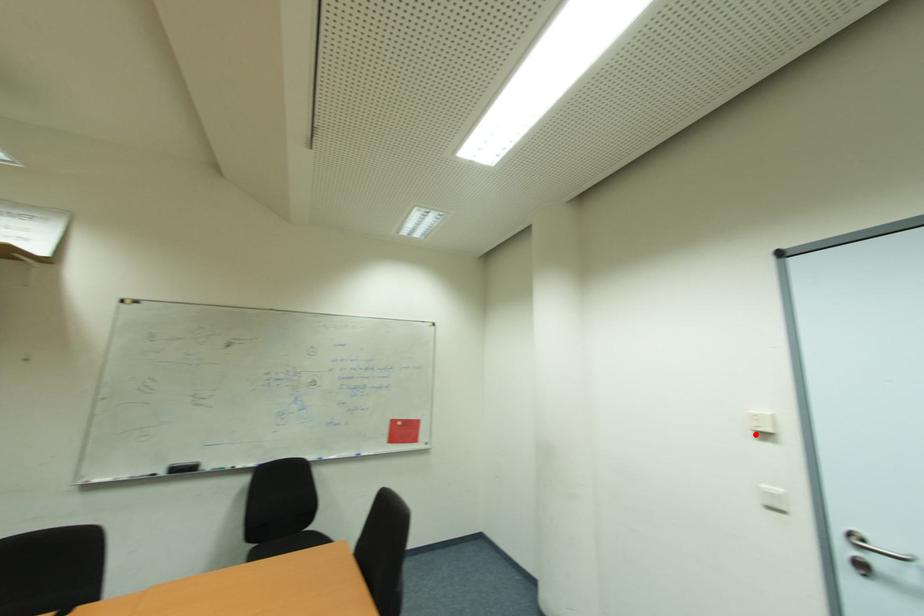
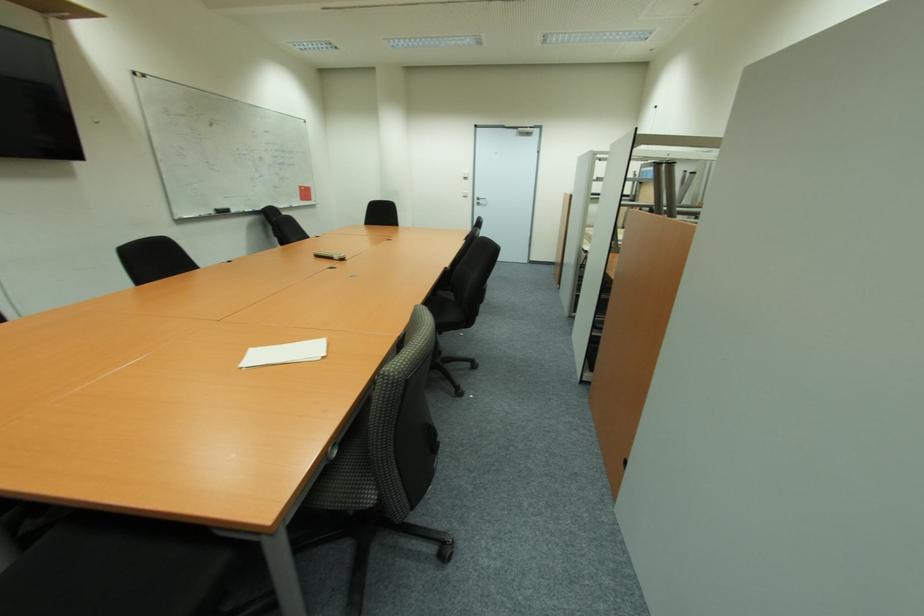
Question: I am providing you with two images of the same scene from different viewpoints. Given a red point in image1, look at the same physical point in image2. Is it:

Choices:
 (A) Closer to the viewpoint
 (B) Farther from the viewpoint

Answer: (A)